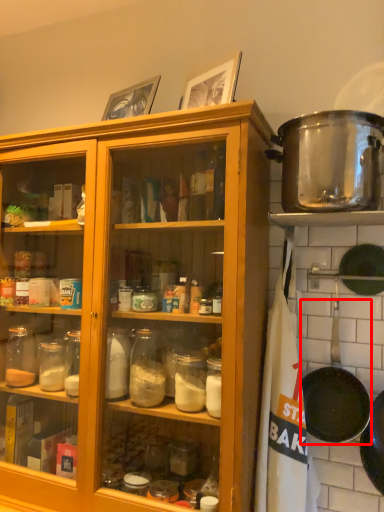
Question: From the image's perspective, what is the correct spatial positioning of frying pan (annotated by the red box) in reference to pot/pan?

Choices:
 (A) below
 (B) above

Answer: (A)